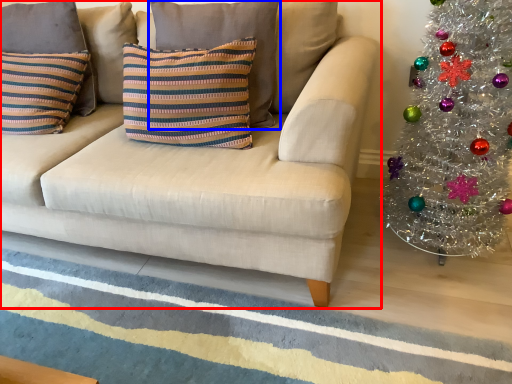
Question: Which object is closer to the camera taking this photo, studio couch (highlighted by a red box) or pillow (highlighted by a blue box)?

Choices:
 (A) studio couch
 (B) pillow

Answer: (A)